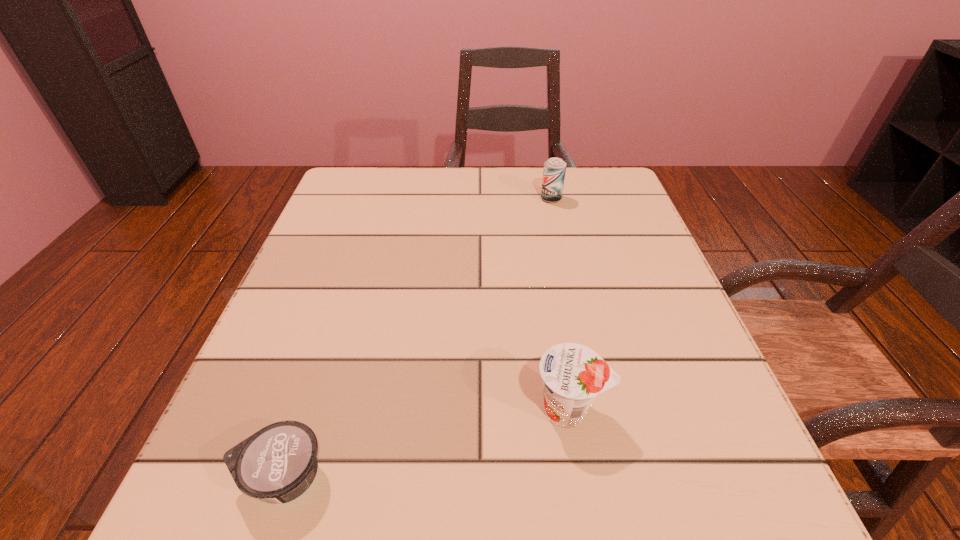
Choose which object is the second nearest neighbor to the shortest object. Please provide its 2D coordinates. Your answer should be formatted as a tuple, i.e. [(x, y)], where the tuple contains the x and y coordinates of a point satisfying the conditions above.

[(554, 170)]